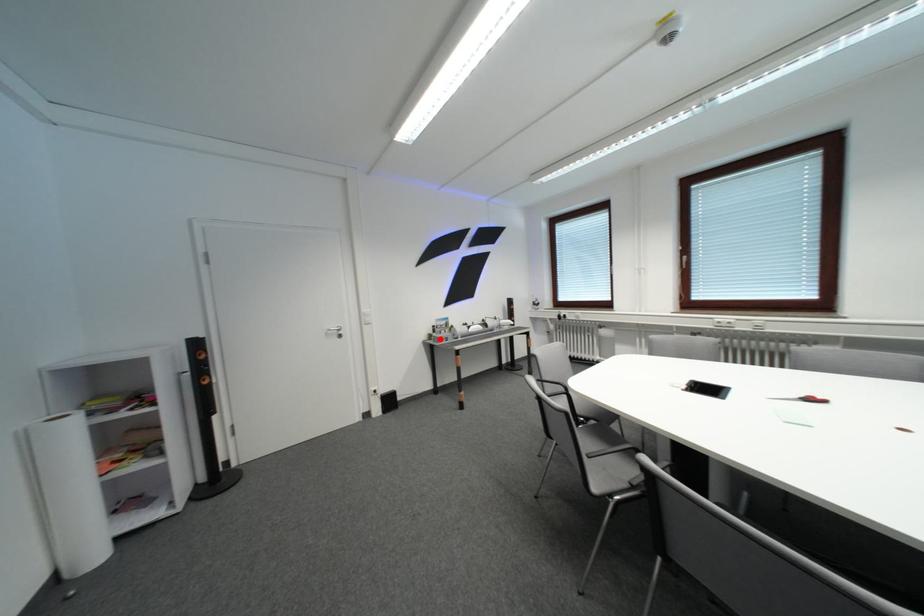
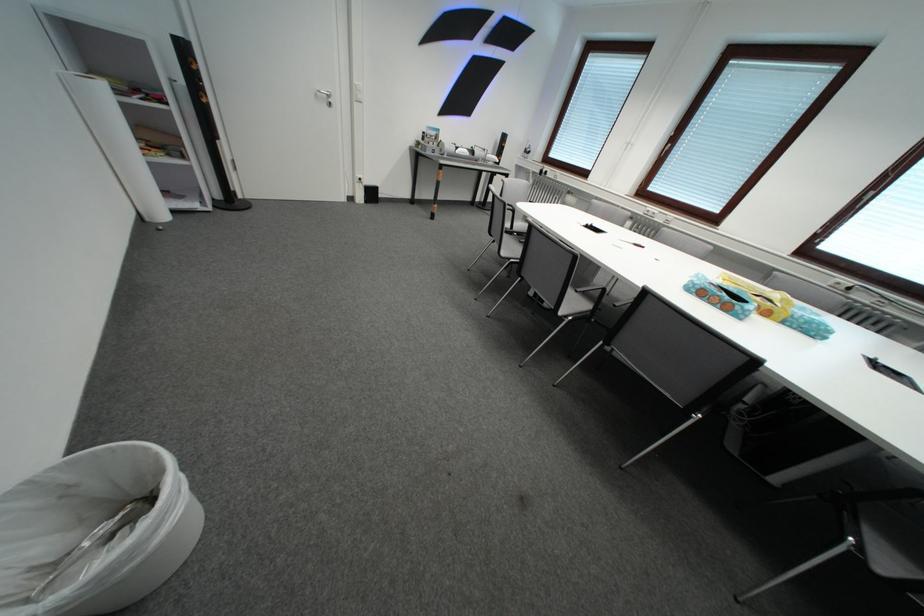
Question: I am providing you with two images of the same scene from different viewpoints. Given a red point in image1, look at the same physical point in image2. Is it:

Choices:
 (A) Closer to the viewpoint
 (B) Farther from the viewpoint

Answer: (A)